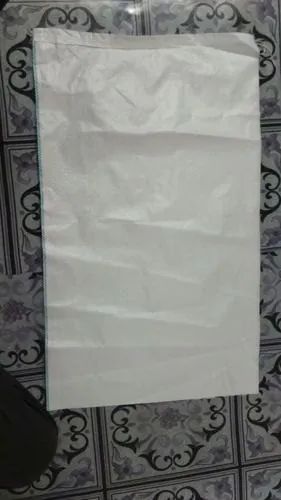
Where is `slipper`? The width and height of the screenshot is (281, 500). slipper is located at coordinates (32, 425).